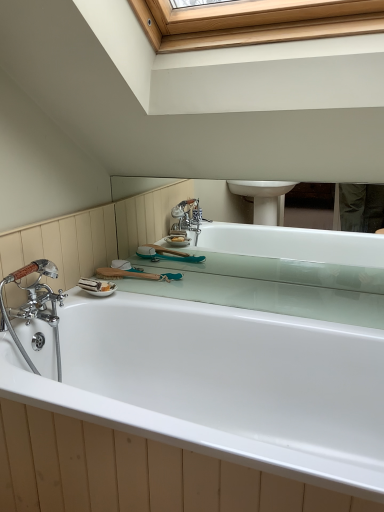
This screenshot has width=384, height=512. What do you see at coordinates (185, 405) in the screenshot? I see `white glossy bathtub at center` at bounding box center [185, 405].

Where is `white glossy bathtub at center`? The width and height of the screenshot is (384, 512). white glossy bathtub at center is located at coordinates (185, 405).

Locate an element on the screen. The height and width of the screenshot is (512, 384). wooden handled brush at upper center is located at coordinates (136, 274).

Describe the element at coordinates (136, 274) in the screenshot. I see `wooden handled brush at upper center` at that location.

Find the location of `white glossy bathtub at center`. white glossy bathtub at center is located at coordinates (185, 405).

Can you confirm if white glossy bathtub at center is positioned to the left of wooden handled brush at upper center?

No.

Which object is further away from the camera, white glossy bathtub at center or wooden handled brush at upper center?

wooden handled brush at upper center is further from the camera.

Is point (196, 435) less distant than point (117, 272)?

That is True.

From the image's perspective, is white glossy bathtub at center on top of wooden handled brush at upper center?

No, from the image's perspective, white glossy bathtub at center is not on top of wooden handled brush at upper center.

Based on the photo, from a real-world perspective, which is physically below, white glossy bathtub at center or wooden handled brush at upper center?

white glossy bathtub at center is physically lower.

Considering the sizes of white glossy bathtub at center and wooden handled brush at upper center in the image, is white glossy bathtub at center wider or thinner than wooden handled brush at upper center?

white glossy bathtub at center is wider than wooden handled brush at upper center.

Is white glossy bathtub at center taller than wooden handled brush at upper center?

Yes, white glossy bathtub at center is taller than wooden handled brush at upper center.

Who is smaller, white glossy bathtub at center or wooden handled brush at upper center?

wooden handled brush at upper center is smaller.

Is wooden handled brush at upper center completely or partially inside white glossy bathtub at center?

No, wooden handled brush at upper center is not surrounded by white glossy bathtub at center.

Consider the image. Are white glossy bathtub at center and wooden handled brush at upper center making contact?

white glossy bathtub at center is not next to wooden handled brush at upper center, and they're not touching.

Is white glossy bathtub at center oriented towards wooden handled brush at upper center?

No, white glossy bathtub at center is not aimed at wooden handled brush at upper center.

How many degrees apart are the facing directions of white glossy bathtub at center and wooden handled brush at upper center?

The angular difference between white glossy bathtub at center and wooden handled brush at upper center is 92.1 degrees.

Find the location of a particular element. This screenshot has height=512, width=384. bathtub on the right side of wooden handled brush at upper center is located at coordinates (185, 405).

Considering the positions of objects wooden handled brush at upper center and white glossy bathtub at center in the image provided, who is more to the left, wooden handled brush at upper center or white glossy bathtub at center?

wooden handled brush at upper center.

Considering their positions, is wooden handled brush at upper center located in front of or behind white glossy bathtub at center?

In the image, wooden handled brush at upper center appears behind white glossy bathtub at center.

Considering the positions of point (158, 279) and point (324, 381), is point (158, 279) closer or farther from the camera than point (324, 381)?

Point (158, 279) is farther from the camera than point (324, 381).

From the image's perspective, is wooden handled brush at upper center on top of white glossy bathtub at center?

Yes, from the image's perspective, wooden handled brush at upper center is over white glossy bathtub at center.

From a real-world perspective, is wooden handled brush at upper center physically located above or below white glossy bathtub at center?

wooden handled brush at upper center is above white glossy bathtub at center.

Which object is wider, wooden handled brush at upper center or white glossy bathtub at center?

Wider between the two is white glossy bathtub at center.

Can you confirm if wooden handled brush at upper center is shorter than white glossy bathtub at center?

Yes, wooden handled brush at upper center is shorter than white glossy bathtub at center.

Can you confirm if wooden handled brush at upper center is smaller than white glossy bathtub at center?

Correct, wooden handled brush at upper center occupies less space than white glossy bathtub at center.

Is wooden handled brush at upper center outside of white glossy bathtub at center?

Yes, wooden handled brush at upper center is outside of white glossy bathtub at center.

Is wooden handled brush at upper center touching white glossy bathtub at center?

No, wooden handled brush at upper center is not in contact with white glossy bathtub at center.

Looking at this image, is wooden handled brush at upper center oriented towards white glossy bathtub at center?

No, wooden handled brush at upper center is not oriented towards white glossy bathtub at center.

Can you tell me how much wooden handled brush at upper center and white glossy bathtub at center differ in facing direction?

92.1 degrees.

At what (x,y) coordinates should I click in order to perform the action: click on shower above the white glossy bathtub at center (from a real-world perspective). Please return your answer as a coordinate pair (x, y). Image resolution: width=384 pixels, height=512 pixels. Looking at the image, I should click on (136, 274).

Where is `shower behind the white glossy bathtub at center`? The width and height of the screenshot is (384, 512). shower behind the white glossy bathtub at center is located at coordinates (136, 274).

This screenshot has height=512, width=384. Identify the location of bathtub below the wooden handled brush at upper center (from a real-world perspective). (185, 405).